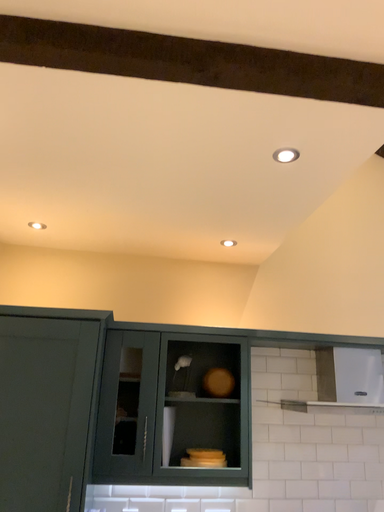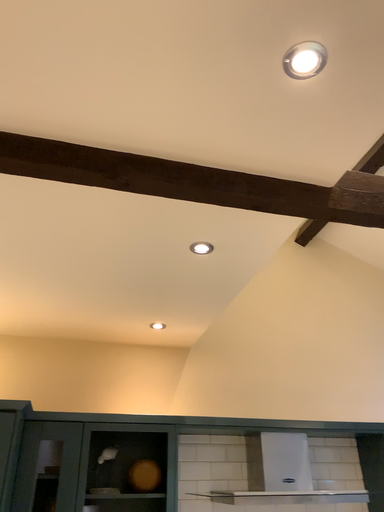
Question: Which way did the camera rotate in the video?

Choices:
 (A) rotated downward
 (B) rotated upward

Answer: (B)